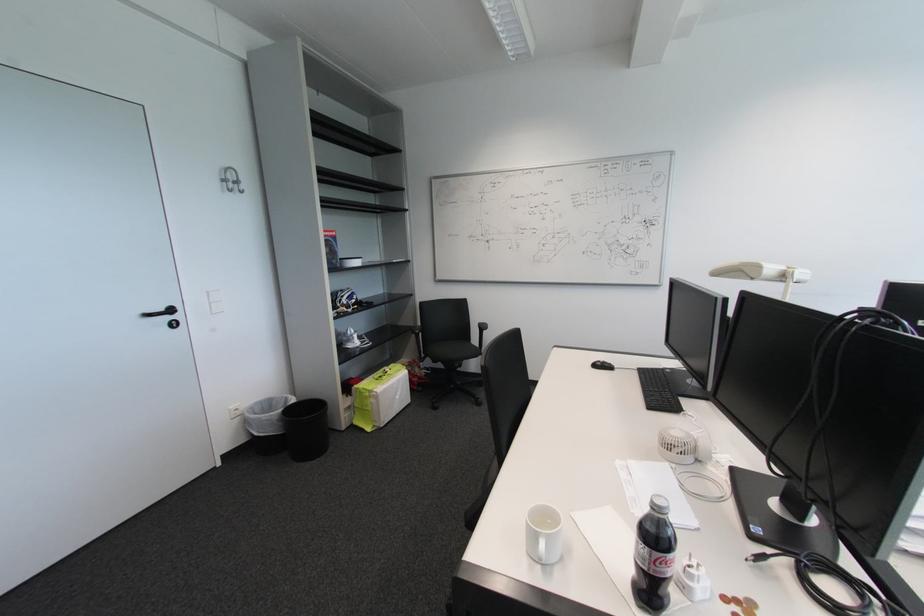
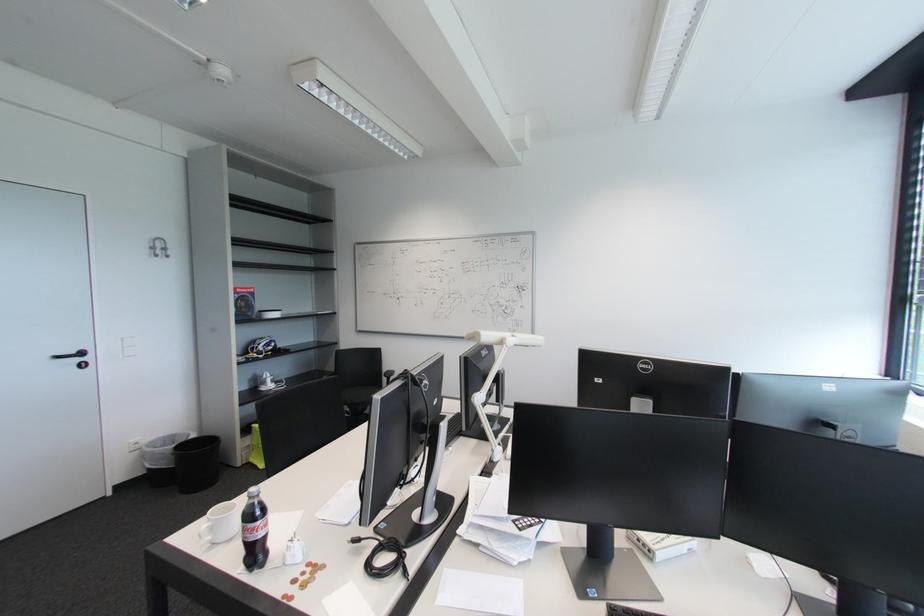
Find the pixel in the second image that matches point (281, 405) in the first image.

(184, 440)